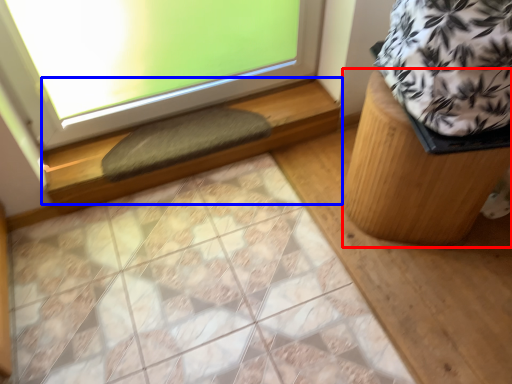
Question: Which of the following is the closest to the observer, furniture (highlighted by a red box) or window sill (highlighted by a blue box)?

Choices:
 (A) furniture
 (B) window sill

Answer: (A)